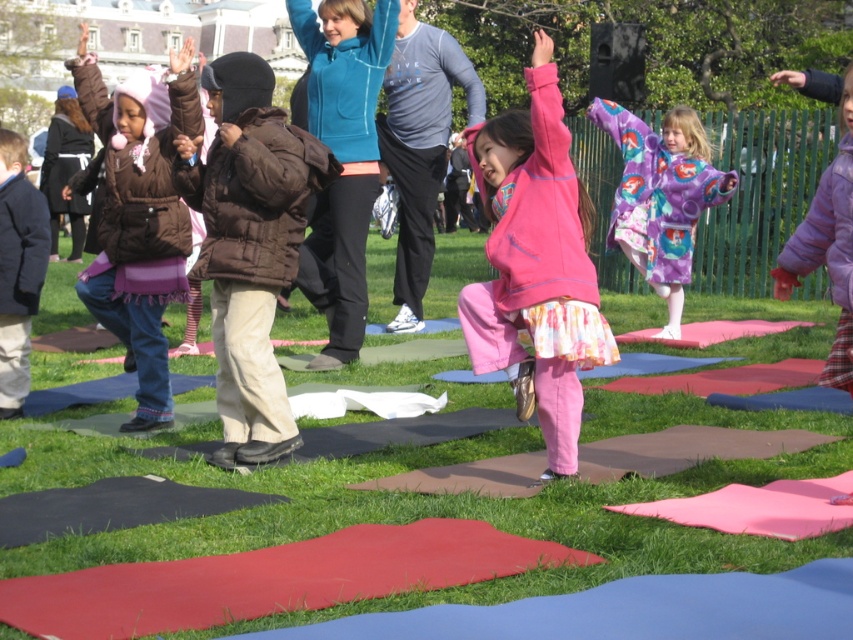
Is fluffy purple coat at center below purple fleece jacket at upper right?

Incorrect, fluffy purple coat at center is not positioned below purple fleece jacket at upper right.

Between point (646, 216) and point (838, 324), which one is positioned behind?

The point (646, 216) is more distant.

Is point (668, 124) positioned after point (836, 285)?

Yes, point (668, 124) is farther from viewer.

I want to click on fluffy purple coat at center, so click(660, 196).

Can you confirm if brown puffy jacket at center is thinner than pink matte/satin dress at center?

No.

Does brown puffy jacket at center have a lesser height compared to pink matte/satin dress at center?

In fact, brown puffy jacket at center may be taller than pink matte/satin dress at center.

The height and width of the screenshot is (640, 853). Identify the location of brown puffy jacket at center. (248, 244).

Identify the location of brown puffy jacket at center. (248, 244).

Is point (534, 118) positioned after point (630, 205)?

No, it is in front of (630, 205).

Between pink matte/satin dress at center and fluffy purple coat at center, which one has more height?

fluffy purple coat at center is taller.

Is point (555, 106) farther from viewer compared to point (627, 116)?

That is False.

Where is `pink matte/satin dress at center`? pink matte/satin dress at center is located at coordinates (535, 257).